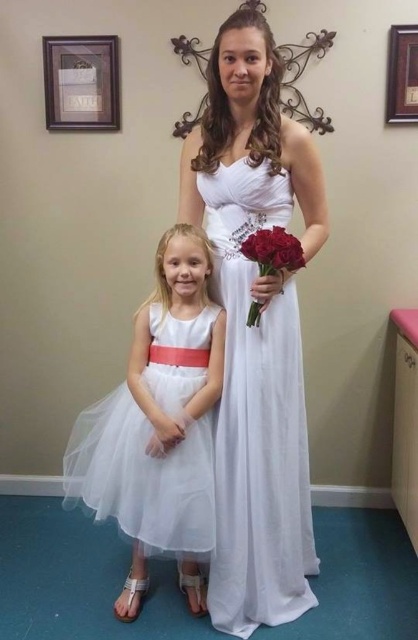
Who is more forward, (142, 330) or (282, 248)?

Positioned in front is point (282, 248).

Who is positioned more to the left, white tulle dress at center or matte red roses at center?

Positioned to the left is white tulle dress at center.

Is point (203, 355) farther from camera compared to point (264, 260)?

Yes, point (203, 355) is behind point (264, 260).

Locate an element on the screen. This screenshot has height=640, width=418. white tulle dress at center is located at coordinates (158, 426).

Is white satin dress at center to the left of red velvet roses at center from the viewer's perspective?

No, white satin dress at center is not to the left of red velvet roses at center.

Describe the element at coordinates (255, 328) in the screenshot. I see `white satin dress at center` at that location.

Does point (234, 132) lie in front of point (280, 260)?

No, (234, 132) is behind (280, 260).

Find the location of a particular element. The height and width of the screenshot is (640, 418). white satin dress at center is located at coordinates (255, 328).

Between point (234, 195) and point (155, 380), which one is positioned behind?

Positioned behind is point (155, 380).

Is white satin dress at center further to camera compared to white tulle dress at center?

That is False.

You are a GUI agent. You are given a task and a screenshot of the screen. Output one action in this format:
    pyautogui.click(x=<x>, y=<y>)
    Task: Click on the white satin dress at center
    Image resolution: width=418 pixels, height=640 pixels.
    Given the screenshot: What is the action you would take?
    pyautogui.click(x=255, y=328)